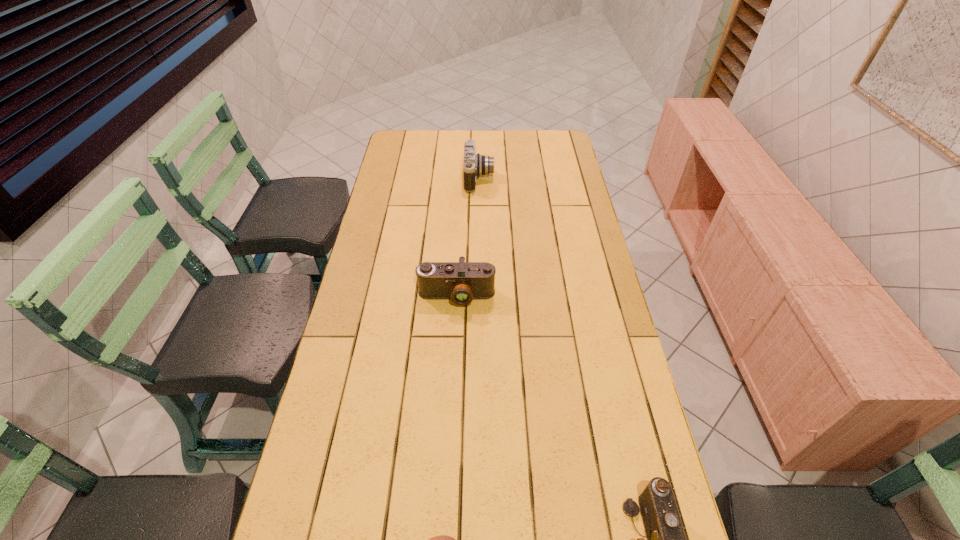
The width and height of the screenshot is (960, 540). I want to click on the tallest object, so click(474, 164).

At what (x,y) coordinates should I click in order to perform the action: click on the tallest camera. Please return your answer as a coordinate pair (x, y). The width and height of the screenshot is (960, 540). Looking at the image, I should click on (474, 164).

You are a GUI agent. You are given a task and a screenshot of the screen. Output one action in this format:
    pyautogui.click(x=<x>, y=<y>)
    Task: Click on the second farthest camera
    This screenshot has width=960, height=540.
    Given the screenshot: What is the action you would take?
    pyautogui.click(x=461, y=282)

Where is `vacant space positioned 0.240m on the front-facing side of the tallest camera`? vacant space positioned 0.240m on the front-facing side of the tallest camera is located at coordinates (552, 178).

Find the location of `free space located 0.270m on the lens of the second farthest camera`. free space located 0.270m on the lens of the second farthest camera is located at coordinates coord(452,392).

The height and width of the screenshot is (540, 960). What are the coordinates of `free location at the far edge of the desktop` in the screenshot? It's located at (527, 156).

The width and height of the screenshot is (960, 540). What are the coordinates of `vacant space at the left edge` in the screenshot? It's located at (349, 453).

Where is `vacant space at the right edge of the desktop`? The width and height of the screenshot is (960, 540). vacant space at the right edge of the desktop is located at coordinates [540, 187].

At what (x,y) coordinates should I click in order to perform the action: click on vacant space at the far left corner of the desktop. Please return your answer as a coordinate pair (x, y). The image size is (960, 540). Looking at the image, I should click on (404, 148).

Locate an element on the screen. Image resolution: width=960 pixels, height=540 pixels. vacant point located between the third nearest object and the tallest object is located at coordinates (468, 237).